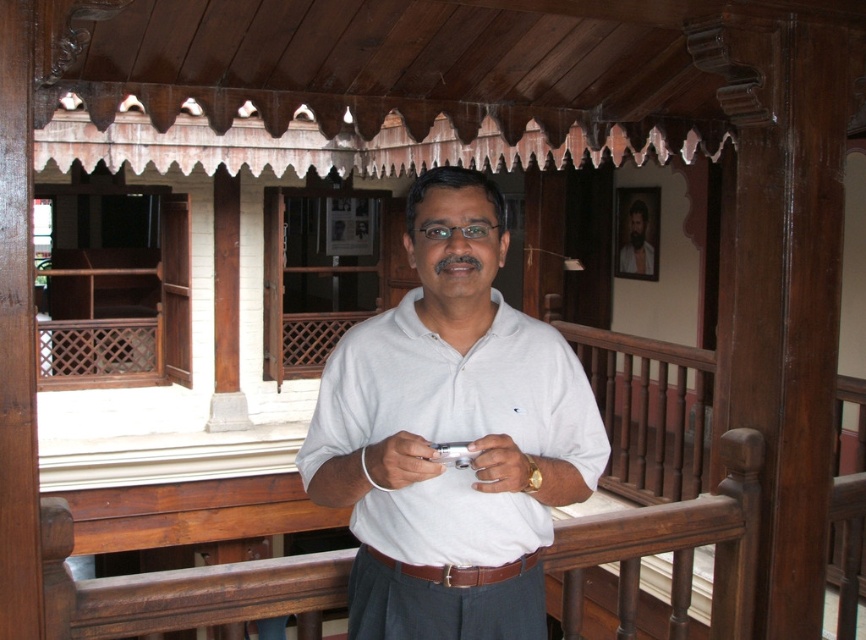
Is white matte shirt at center wider than white matte hand at center?

Yes, white matte shirt at center is wider than white matte hand at center.

Between white matte shirt at center and white matte hand at center, which one appears on the right side from the viewer's perspective?

white matte hand at center

Does point (464, 337) come farther from viewer compared to point (481, 442)?

Yes, it is.

The image size is (866, 640). I want to click on white matte shirt at center, so click(x=451, y=433).

Can you confirm if white matte hand at center is bigger than bearded man at center?

No, white matte hand at center is not bigger than bearded man at center.

Who is more distant from viewer, (488,483) or (621,253)?

Point (621,253)

I want to click on white matte hand at center, so click(501, 465).

The width and height of the screenshot is (866, 640). In order to click on white matte hand at center in this screenshot , I will do `click(501, 465)`.

Who is higher up, white matte shirt at center or white matte wristband at center?

white matte shirt at center is higher up.

Can you confirm if white matte shirt at center is taller than white matte wristband at center?

Yes, white matte shirt at center is taller than white matte wristband at center.

Which is behind, point (402, 516) or point (399, 483)?

Positioned behind is point (402, 516).

This screenshot has width=866, height=640. Identify the location of white matte shirt at center. (451, 433).